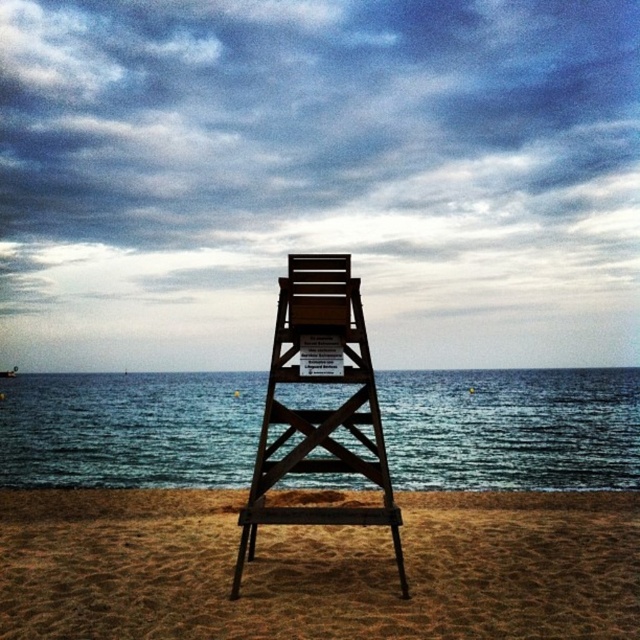
Does blue water at center appear under wooden lifeguard chair at center?

Yes, blue water at center is below wooden lifeguard chair at center.

Is point (97, 417) in front of point (374, 515)?

No, it is behind (374, 515).

The width and height of the screenshot is (640, 640). I want to click on blue water at center, so click(512, 428).

This screenshot has width=640, height=640. I want to click on blue water at center, so click(x=512, y=428).

Which is below, brown sandy beach at center or wooden lifeguard chair at center?

brown sandy beach at center

Does brown sandy beach at center have a greater width compared to wooden lifeguard chair at center?

Yes, brown sandy beach at center is wider than wooden lifeguard chair at center.

This screenshot has height=640, width=640. Describe the element at coordinates (317, 568) in the screenshot. I see `brown sandy beach at center` at that location.

The image size is (640, 640). In order to click on brown sandy beach at center in this screenshot , I will do `click(317, 568)`.

Is brown sandy beach at center to the left of blue water at center from the viewer's perspective?

Incorrect, brown sandy beach at center is not on the left side of blue water at center.

This screenshot has height=640, width=640. I want to click on brown sandy beach at center, so click(x=317, y=568).

This screenshot has width=640, height=640. What are the coordinates of `brown sandy beach at center` in the screenshot? It's located at (317, 568).